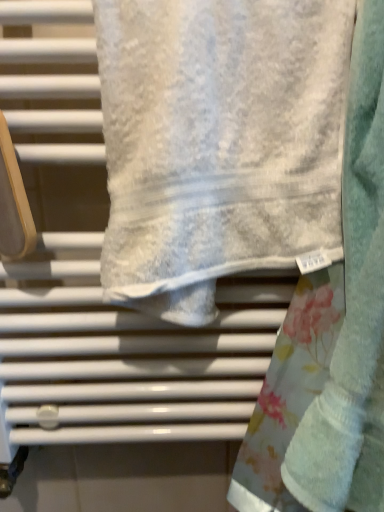
Question: Is white textured towel at center, the 1th towel when ordered from left to right, facing away from fluffy white towel at center, the 1th towel positioned from the right?

Choices:
 (A) no
 (B) yes

Answer: (A)

Question: Is white textured towel at center, placed as the 2th towel when sorted from right to left, wider than fluffy white towel at center, which appears as the second towel when viewed from the left?

Choices:
 (A) no
 (B) yes

Answer: (A)

Question: Does white textured towel at center, the 1th towel when ordered from left to right, appear on the right side of fluffy white towel at center, which appears as the second towel when viewed from the left?

Choices:
 (A) no
 (B) yes

Answer: (A)

Question: Is white textured towel at center, the 1th towel when ordered from left to right, shorter than fluffy white towel at center, the 1th towel positioned from the right?

Choices:
 (A) no
 (B) yes

Answer: (B)

Question: Is white textured towel at center, placed as the 2th towel when sorted from right to left, aimed at fluffy white towel at center, which appears as the second towel when viewed from the left?

Choices:
 (A) yes
 (B) no

Answer: (B)

Question: Is fluffy white towel at center, which appears as the second towel when viewed from the left, taller than white textured towel at center, the 1th towel when ordered from left to right?

Choices:
 (A) no
 (B) yes

Answer: (B)

Question: Is fluffy white towel at center, the 1th towel positioned from the right, to the right of white textured towel at center, placed as the 2th towel when sorted from right to left, from the viewer's perspective?

Choices:
 (A) yes
 (B) no

Answer: (A)

Question: Does fluffy white towel at center, which appears as the second towel when viewed from the left, have a lesser width compared to white textured towel at center, the 1th towel when ordered from left to right?

Choices:
 (A) yes
 (B) no

Answer: (B)

Question: Is white textured towel at center, the 1th towel when ordered from left to right, a part of fluffy white towel at center, which appears as the second towel when viewed from the left?

Choices:
 (A) yes
 (B) no

Answer: (B)

Question: Is fluffy white towel at center, which appears as the second towel when viewed from the left, not close to white textured towel at center, the 1th towel when ordered from left to right?

Choices:
 (A) no
 (B) yes

Answer: (A)

Question: Is white textured towel at center, the 1th towel when ordered from left to right, at the back of fluffy white towel at center, which appears as the second towel when viewed from the left?

Choices:
 (A) yes
 (B) no

Answer: (B)

Question: Looking at their shapes, would you say fluffy white towel at center, the 1th towel positioned from the right, is wider or thinner than white textured towel at center, the 1th towel when ordered from left to right?

Choices:
 (A) wide
 (B) thin

Answer: (A)